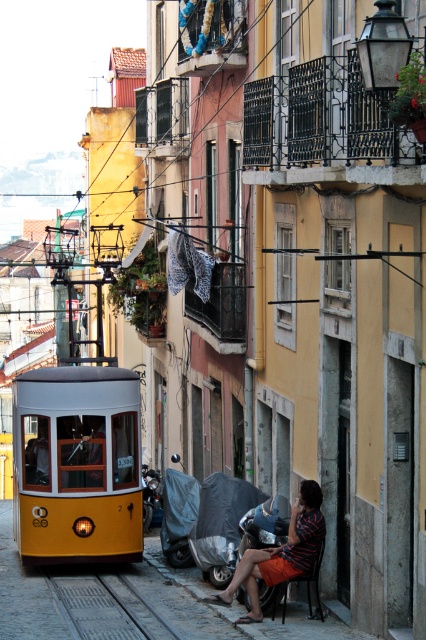
Consider the image. Does yellow matte cable car at lower left come in front of metallic silver motorcycle at lower center?

Yes, it is in front of metallic silver motorcycle at lower center.

Can you confirm if yellow matte cable car at lower left is positioned above metallic silver motorcycle at lower center?

Yes.

Describe the element at coordinates (77, 465) in the screenshot. This screenshot has height=640, width=426. I see `yellow matte cable car at lower left` at that location.

Identify the location of yellow matte cable car at lower left. Image resolution: width=426 pixels, height=640 pixels. (77, 465).

Can you confirm if gray metallic train track at lower center is smaller than metallic silver motorcycle at lower center?

Actually, gray metallic train track at lower center might be larger than metallic silver motorcycle at lower center.

At what (x,y) coordinates should I click in order to perform the action: click on gray metallic train track at lower center. Please return your answer as a coordinate pair (x, y). The image size is (426, 640). Looking at the image, I should click on (109, 608).

Who is more forward, (104, 636) or (261, 557)?

Point (104, 636)

Where is `gray metallic train track at lower center`? Image resolution: width=426 pixels, height=640 pixels. gray metallic train track at lower center is located at coordinates pos(109,608).